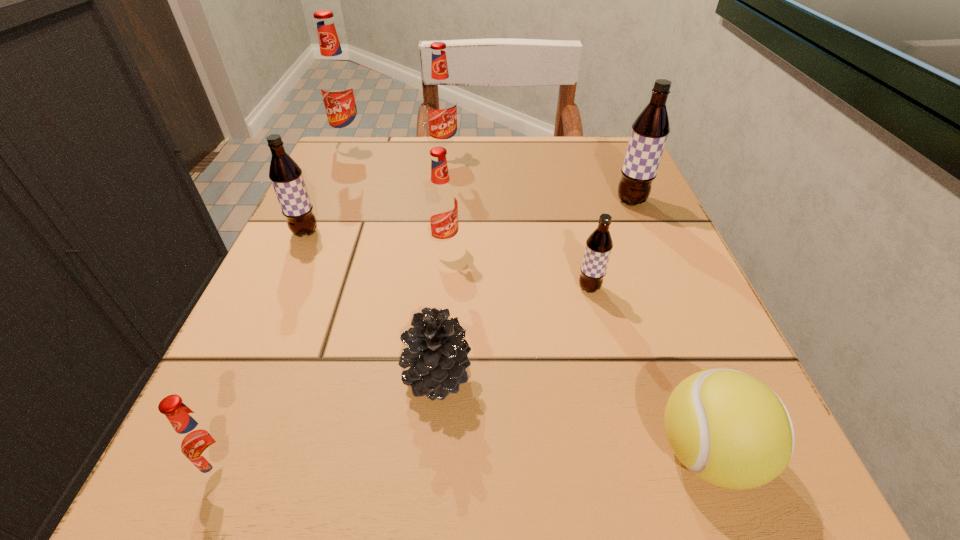
Identify the location of red root beer that is the second nearest to the pinecone. The image size is (960, 540). click(x=442, y=206).

Locate which brown root beer ranks in proximity to the third smallest red root beer. Please provide its 2D coordinates. Your answer should be formatted as a tuple, i.e. [(x, y)], where the tuple contains the x and y coordinates of a point satisfying the conditions above.

[(286, 176)]

At what (x,y) coordinates should I click in order to perform the action: click on brown root beer identified as the closest to the second nearest root beer. Please return your answer as a coordinate pair (x, y). Looking at the image, I should click on (650, 130).

Locate an element on the screen. The image size is (960, 540). vacant area that satisfies the following two spatial constraints: 1. on the back side of the biggest brown root beer; 2. on the right side of the nearest red root beer is located at coordinates (337, 201).